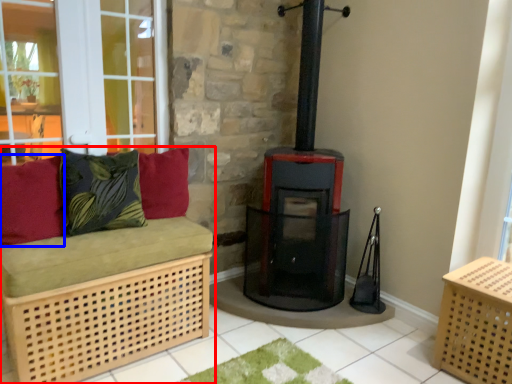
Question: Among these objects, which one is farthest to the camera, furniture (highlighted by a red box) or pillow (highlighted by a blue box)?

Choices:
 (A) furniture
 (B) pillow

Answer: (B)